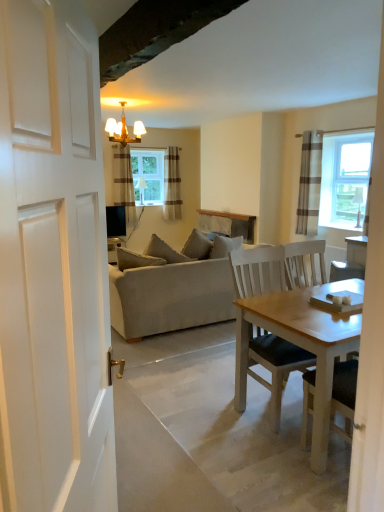
Question: Considering their positions, is clear glass window at center located in front of or behind brown striped curtain at upper center, the 1th curtain when ordered from back to front?

Choices:
 (A) front
 (B) behind

Answer: (B)

Question: Considering the positions of point (155, 186) and point (175, 177), is point (155, 186) closer or farther from the camera than point (175, 177)?

Choices:
 (A) farther
 (B) closer

Answer: (A)

Question: Which object is positioned farthest from the brown striped curtain at right, which is counted as the third curtain, starting from the back?

Choices:
 (A) brown striped curtain at upper center, the 1th curtain when ordered from back to front
 (B) gold metallic chandelier at upper center
 (C) beige fabric couch at center
 (D) striped fabric curtain at center, the second curtain when ordered from front to back
 (E) clear glass window at center

Answer: (D)

Question: Estimate the real-world distances between objects in this image. Which object is farther from the gold metallic chandelier at upper center?

Choices:
 (A) beige fabric couch at center
 (B) clear glass window at center
 (C) striped fabric curtain at center, marked as the 3th curtain in a right-to-left arrangement
 (D) brown striped curtain at upper center, the 1th curtain when ordered from back to front
 (E) brown striped curtain at right, positioned as the 3th curtain in left-to-right order

Answer: (A)